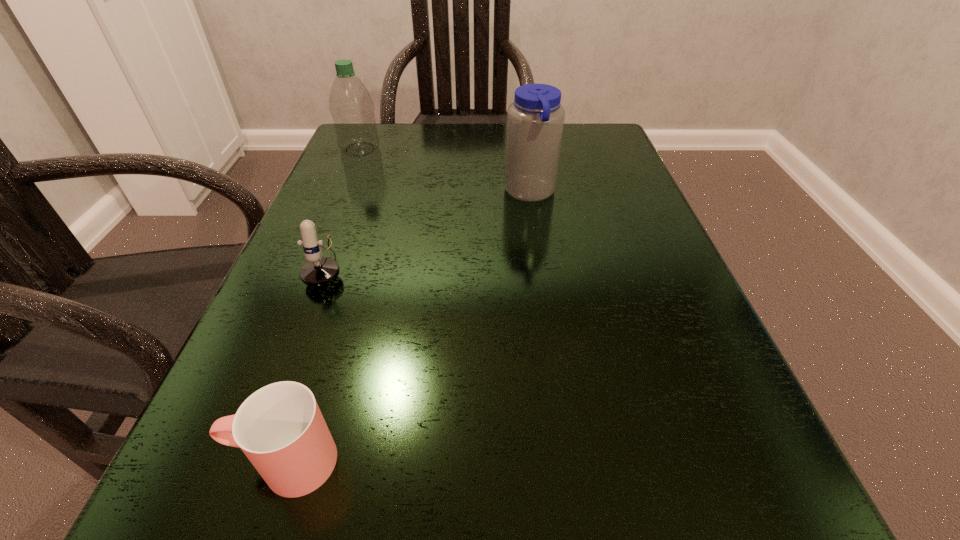
At what (x,y) coordinates should I click in order to perform the action: click on vacant space located on the back of the microphone. Please return your answer as a coordinate pair (x, y). The height and width of the screenshot is (540, 960). Looking at the image, I should click on (372, 148).

This screenshot has height=540, width=960. Identify the location of object located in the far edge section of the desktop. (351, 106).

Locate an element on the screen. The height and width of the screenshot is (540, 960). object situated at the near edge is located at coordinates (280, 428).

At what (x,y) coordinates should I click in order to perform the action: click on water bottle located at the left edge. Please return your answer as a coordinate pair (x, y). This screenshot has width=960, height=540. Looking at the image, I should click on (351, 106).

The width and height of the screenshot is (960, 540). I want to click on microphone at the left edge, so click(318, 271).

The height and width of the screenshot is (540, 960). Identify the location of cup that is at the left edge. (280, 428).

You are a GUI agent. You are given a task and a screenshot of the screen. Output one action in this format:
    pyautogui.click(x=<x>, y=<y>)
    Task: Click on the object at the far left corner
    The width and height of the screenshot is (960, 540).
    Given the screenshot: What is the action you would take?
    pyautogui.click(x=351, y=106)

Locate an element on the screen. object that is at the near left corner is located at coordinates (280, 428).

Identify the location of vacant space at the far edge of the desktop. (440, 160).

In the image, there is a desktop. Identify the location of free space at the near edge. (358, 511).